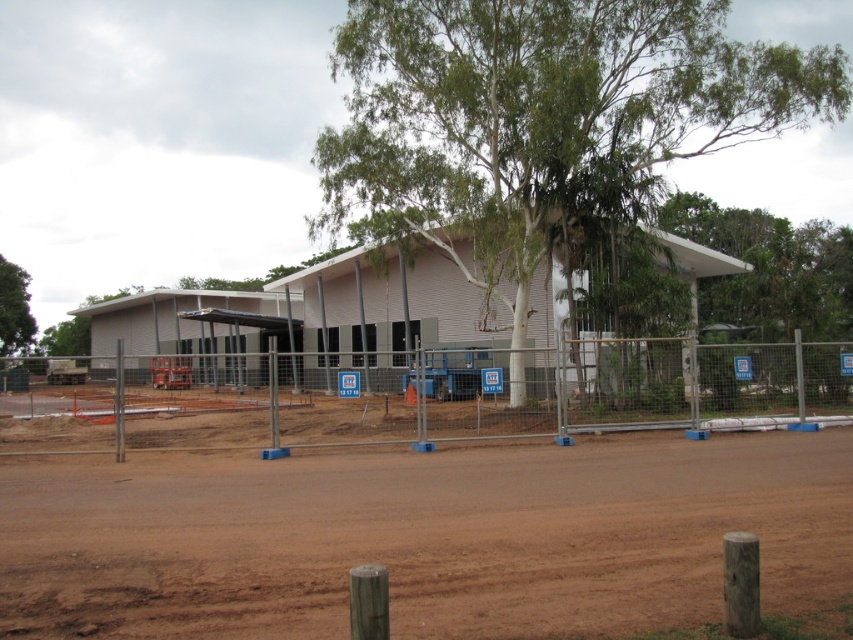
Question: Which point is farther to the camera?

Choices:
 (A) brown dirt track at lower center
 (B) green leafy tree at center
 (C) metal mesh fence at center

Answer: (B)

Question: Which of the following is the closest to the observer?

Choices:
 (A) (459, 131)
 (B) (776, 355)
 (C) (189, 512)
 (D) (15, 278)

Answer: (C)

Question: Does metal mesh fence at center appear over green leafy tree at left?

Choices:
 (A) no
 (B) yes

Answer: (A)

Question: Which of the following is the farthest from the observer?

Choices:
 (A) metal mesh fence at center
 (B) green leafy tree at left
 (C) green leafy tree at center

Answer: (B)

Question: In this image, where is brown dirt track at lower center located relative to metal mesh fence at center?

Choices:
 (A) right
 (B) left

Answer: (A)

Question: Does metal mesh fence at center have a smaller size compared to green leafy tree at left?

Choices:
 (A) yes
 (B) no

Answer: (B)